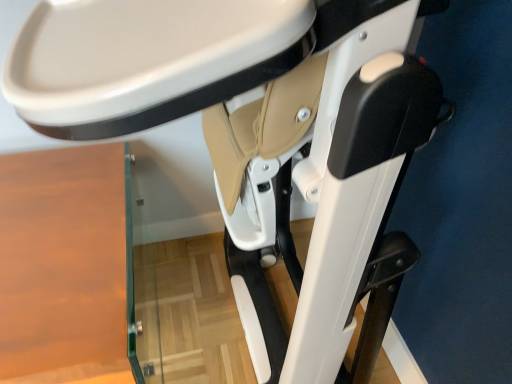
Question: Should I look upward or downward to see wooden table at lower left?

Choices:
 (A) up
 (B) down

Answer: (B)